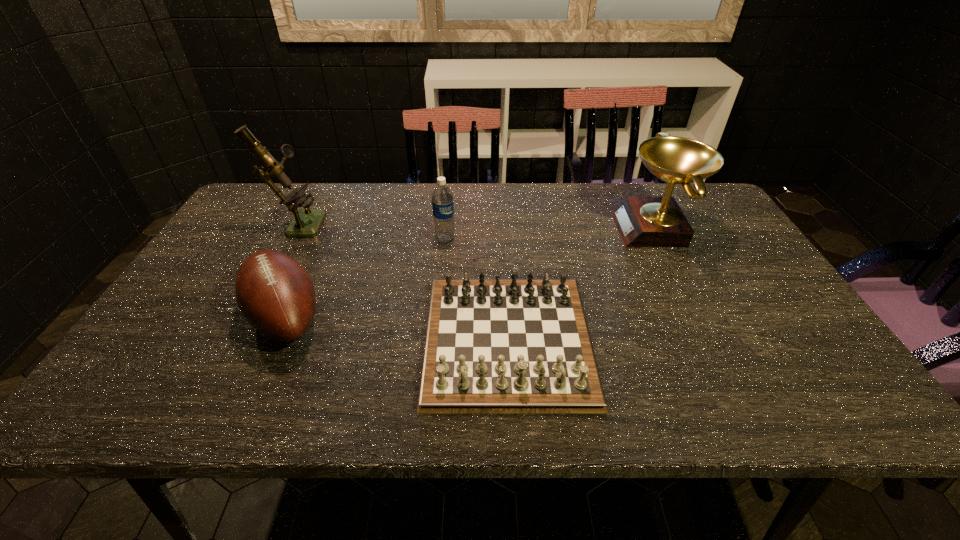
This screenshot has width=960, height=540. I want to click on the tallest object, so click(x=306, y=222).

The width and height of the screenshot is (960, 540). Find the location of `the rightmost object`. the rightmost object is located at coordinates (642, 221).

I want to click on the fourth shortest object, so click(642, 221).

This screenshot has width=960, height=540. What are the coordinates of `water bottle` in the screenshot? It's located at (442, 198).

Identify the location of football (American). (275, 294).

Where is `the shortest object`? This screenshot has width=960, height=540. the shortest object is located at coordinates (493, 346).

This screenshot has width=960, height=540. I want to click on vacant area situated 0.330m at the eyepiece of the microscope, so click(x=432, y=223).

Find the location of a particular element. vacant space situated on the front-facing side of the rightmost object is located at coordinates (581, 229).

Where is `vacant space situated 0.070m on the front-facing side of the rightmost object`? The image size is (960, 540). vacant space situated 0.070m on the front-facing side of the rightmost object is located at coordinates (594, 229).

You are a GUI agent. You are given a task and a screenshot of the screen. Output one action in this format:
    pyautogui.click(x=<x>, y=<y>)
    Task: Click on the blank area located 0.100m on the front-facing side of the rightmost object
    This screenshot has width=960, height=540.
    Given the screenshot: What is the action you would take?
    pyautogui.click(x=584, y=229)